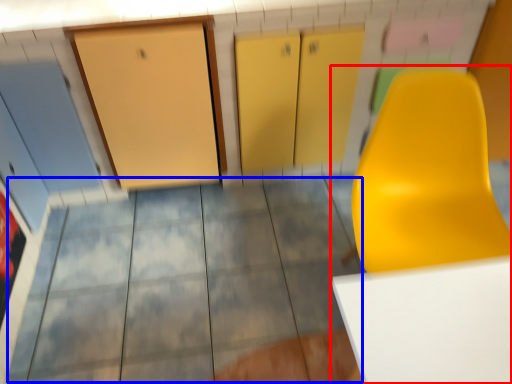
Question: Which object is further to the camera taking this photo, furniture (highlighted by a red box) or tile (highlighted by a blue box)?

Choices:
 (A) furniture
 (B) tile

Answer: (B)